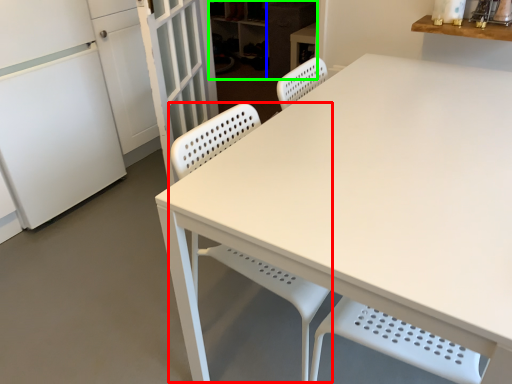
Question: Considering the real-world distances, which object is closest to chair (highlighted by a red box)? cabinetry (highlighted by a blue box) or cabinetry (highlighted by a green box).

Choices:
 (A) cabinetry
 (B) cabinetry

Answer: (A)